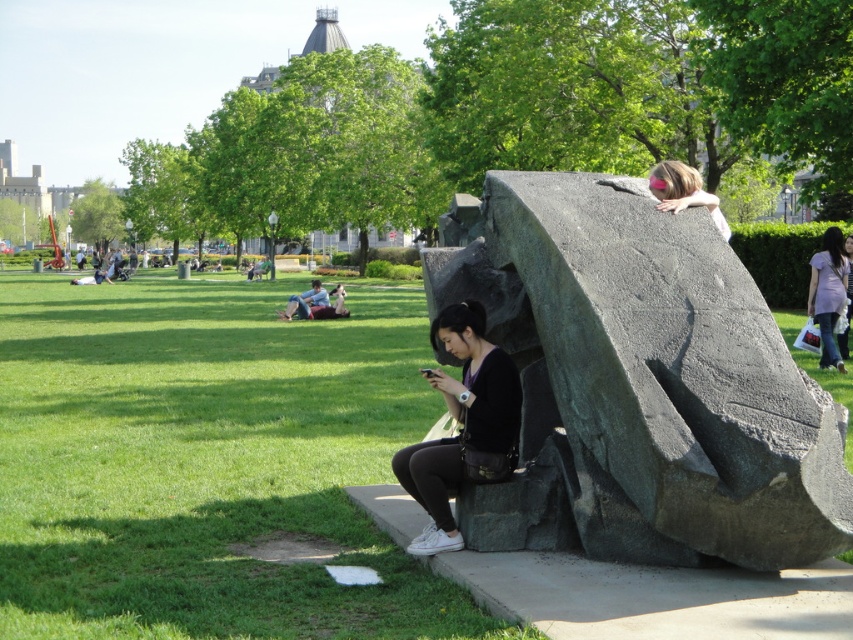
You are standing in the park and see the dark gray stone sculpture at center and the black matte shirt at center. Which object is positioned to the right of the other?

The dark gray stone sculpture at center is to the right of the black matte shirt at center.

You are planning to take a photo of the dark gray stone sculpture at center and the black matte shirt at center. Since you want both subjects to appear clearly in the frame, which one should you focus on first to ensure proper focus?

The dark gray stone sculpture at center has a larger size compared to the black matte shirt at center, so you should focus on the dark gray stone sculpture at center first to ensure proper focus.